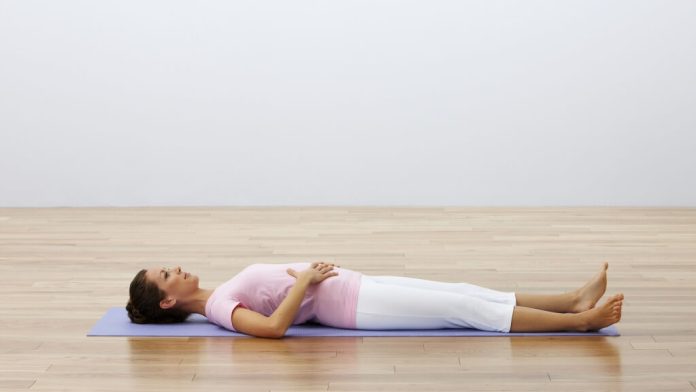
You are a GUI agent. You are given a task and a screenshot of the screen. Output one action in this format:
    pyautogui.click(x=<x>, y=<y>)
    Task: Click on the white wall
    
    Given the screenshot: What is the action you would take?
    pyautogui.click(x=280, y=52)